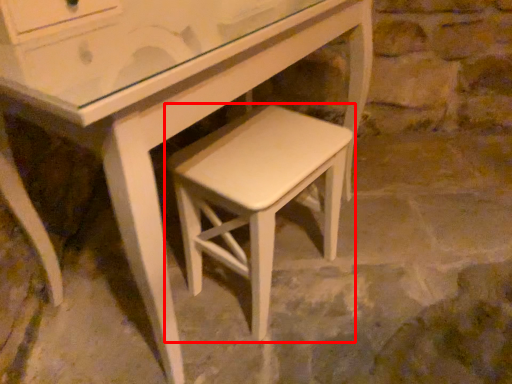
Question: From the image's perspective, considering the relative positions of stool (annotated by the red box) and table in the image provided, where is stool (annotated by the red box) located with respect to the staircase?

Choices:
 (A) below
 (B) above

Answer: (B)